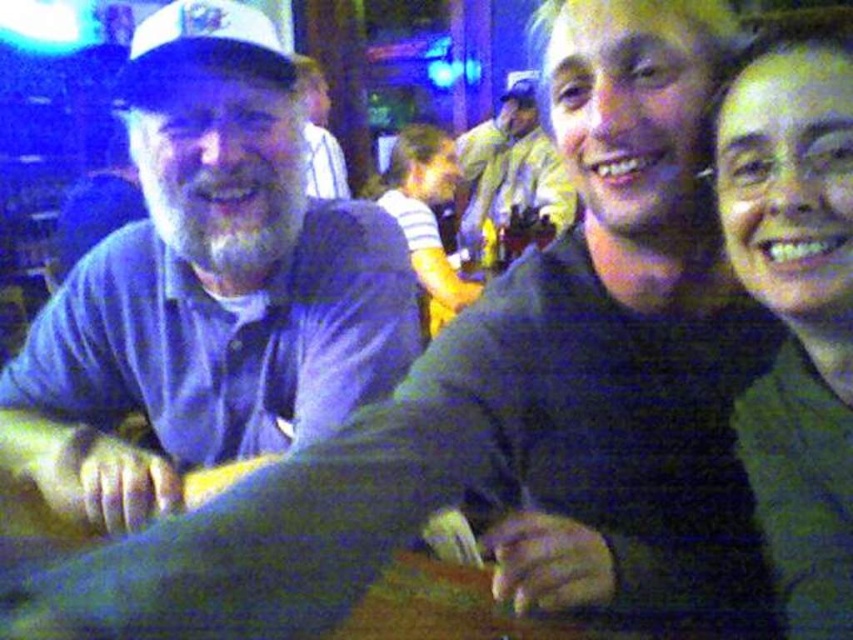
You are a photographer adjusting the lighting for a group photo. You notice the green fuzzy sweater at upper right and the matte white cap at upper left. Which item requires more space in the frame to avoid being cut off?

The matte white cap at upper left requires more space in the frame because its width is greater than the green fuzzy sweater at upper right.